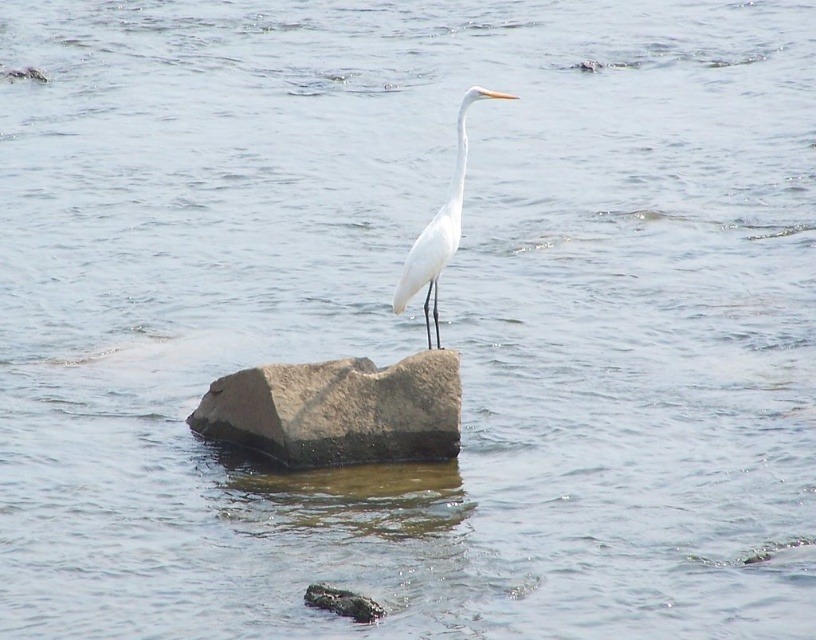
Question: Is gray/rough stone at center closer to camera compared to white matte bird at center?

Choices:
 (A) yes
 (B) no

Answer: (B)

Question: In this image, where is gray/rough stone at center located relative to white matte bird at center?

Choices:
 (A) left
 (B) right

Answer: (A)

Question: Is gray/rough stone at center in front of white matte bird at center?

Choices:
 (A) no
 (B) yes

Answer: (A)

Question: Which point appears farthest from the camera in this image?

Choices:
 (A) [x=234, y=388]
 (B) [x=420, y=250]

Answer: (A)